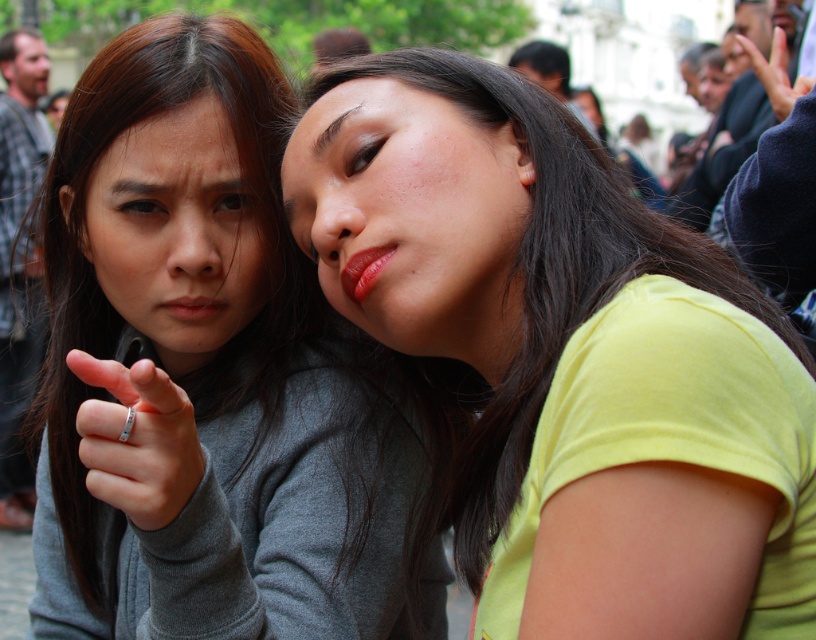
Question: Which object is closer to the camera taking this photo?

Choices:
 (A) yellow matte shirt at center
 (B) glossy matte lips at center
 (C) skinny metallic hand at upper right
 (D) brown hair at upper center

Answer: (A)

Question: Can you confirm if matte gray face at left is positioned to the right of brown hair at upper center?

Choices:
 (A) yes
 (B) no

Answer: (B)

Question: Does matte red lipstick at center have a lesser width compared to skinny metallic hand at upper right?

Choices:
 (A) no
 (B) yes

Answer: (B)

Question: Which object appears farthest from the camera in this image?

Choices:
 (A) matte red lipstick at center
 (B) matte gray face at left
 (C) skinny metallic hand at upper right
 (D) gray matte sweater at left

Answer: (C)

Question: Which of these objects is positioned closest to the skinny metallic hand at upper right?

Choices:
 (A) yellow matte shirt at center
 (B) matte gray face at left
 (C) matte skin face at center

Answer: (A)

Question: Does skinny metallic hand at upper right appear on the right side of glossy matte lips at center?

Choices:
 (A) no
 (B) yes

Answer: (B)